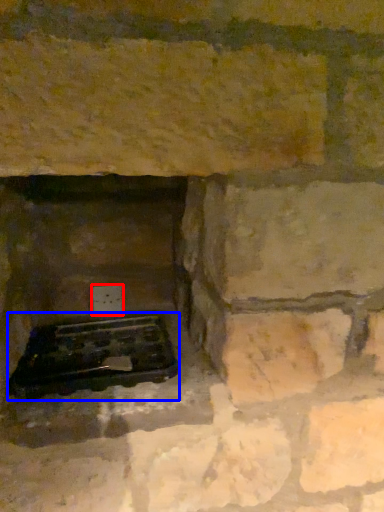
Question: Which point is further to the camera, electric outlet (highlighted by a red box) or grill (highlighted by a blue box)?

Choices:
 (A) electric outlet
 (B) grill

Answer: (A)